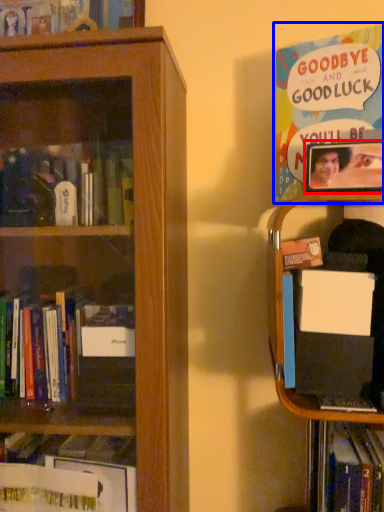
Question: Which point is closer to the camera, picture frame (highlighted by a red box) or book (highlighted by a blue box)?

Choices:
 (A) picture frame
 (B) book

Answer: (A)